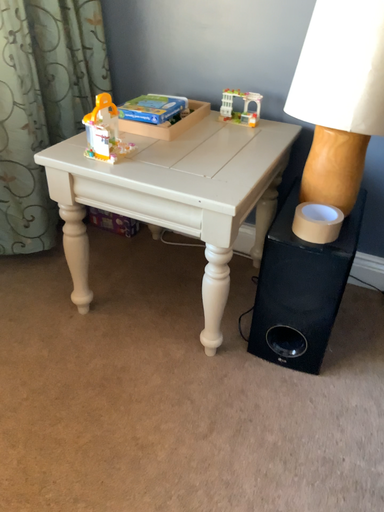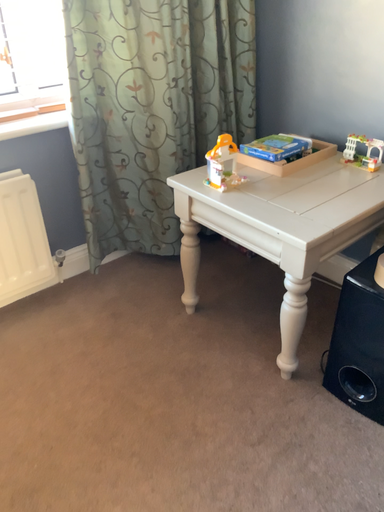
Question: Which way did the camera rotate in the video?

Choices:
 (A) rotated left
 (B) rotated right

Answer: (A)